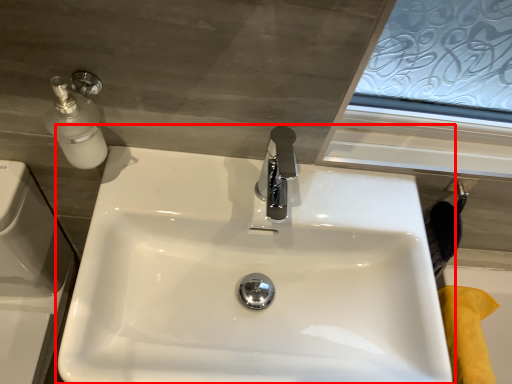
Question: From the image's perspective, what is the correct spatial positioning of sink (annotated by the red box) in reference to bath?

Choices:
 (A) below
 (B) above

Answer: (B)